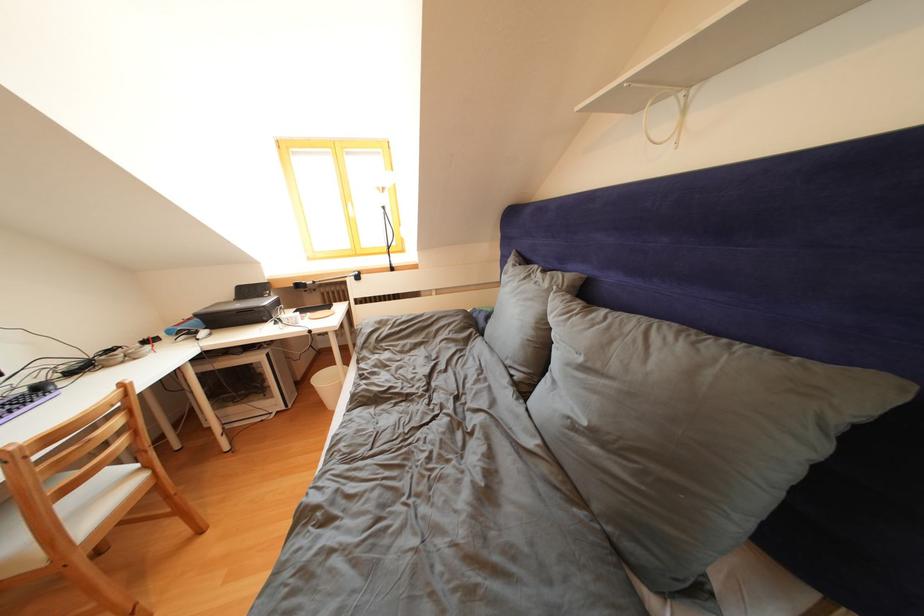
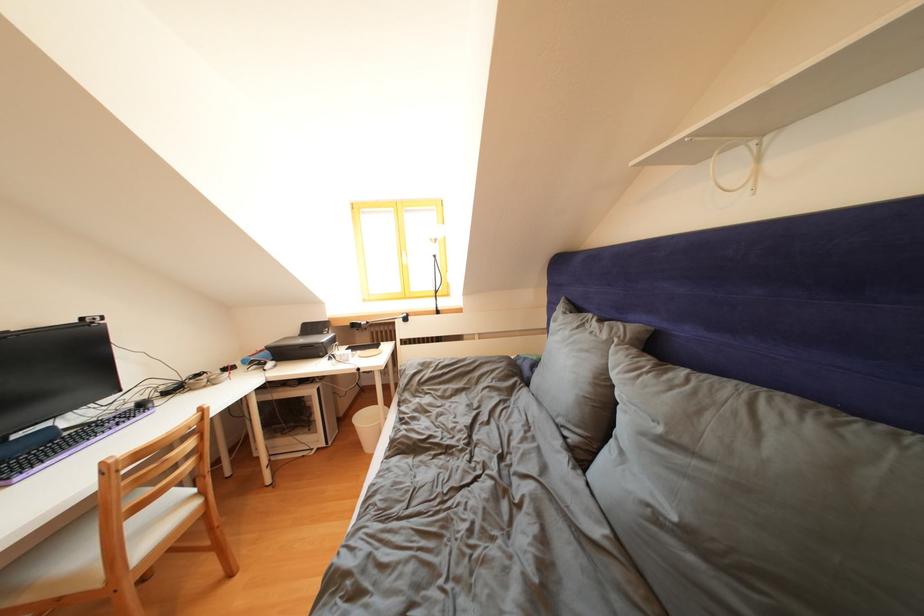
In the second image, find the point that corresponds to (330,384) in the first image.

(371, 424)